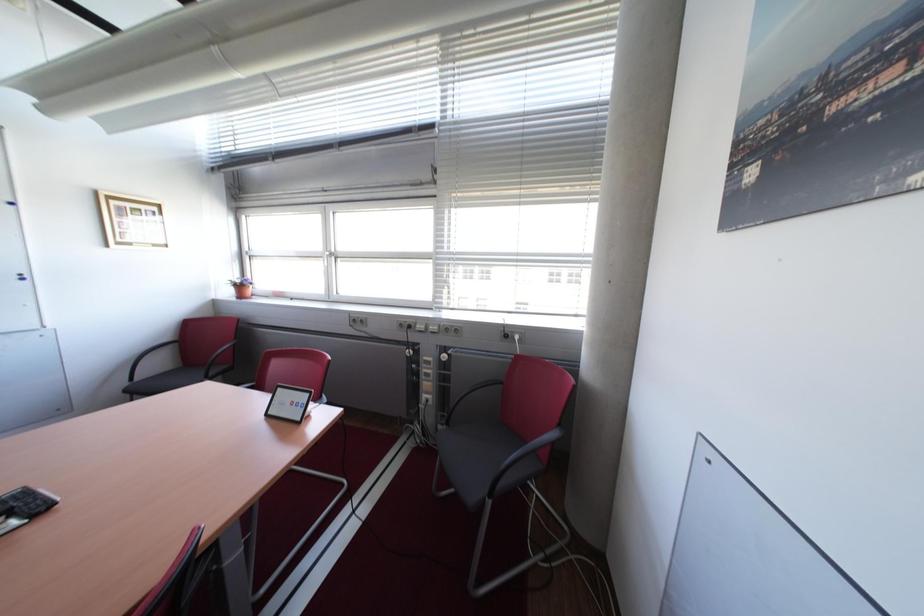
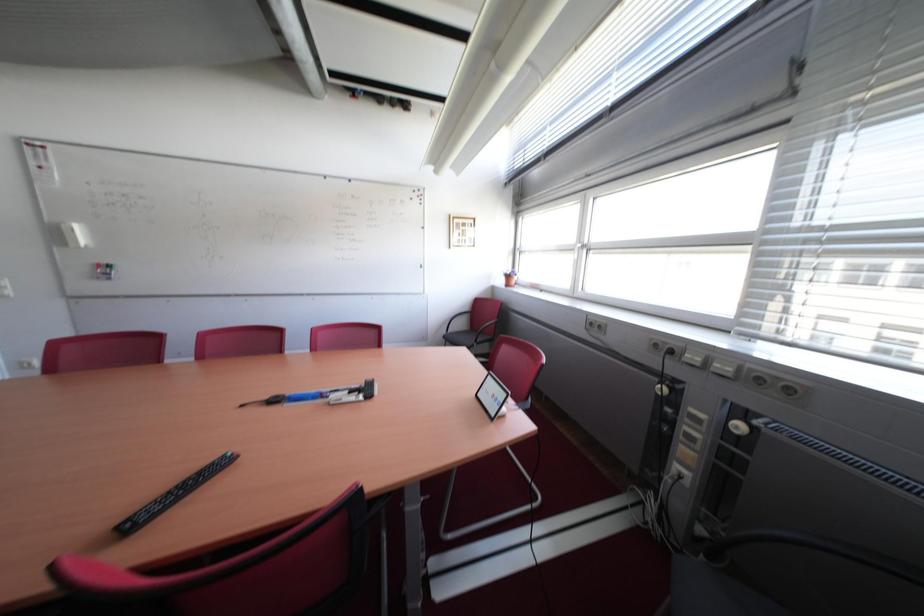
Question: The images are taken continuously from a first-person perspective. In which direction is your viewpoint rotating?

Choices:
 (A) Left
 (B) Right
 (C) Up
 (D) Down

Answer: (A)